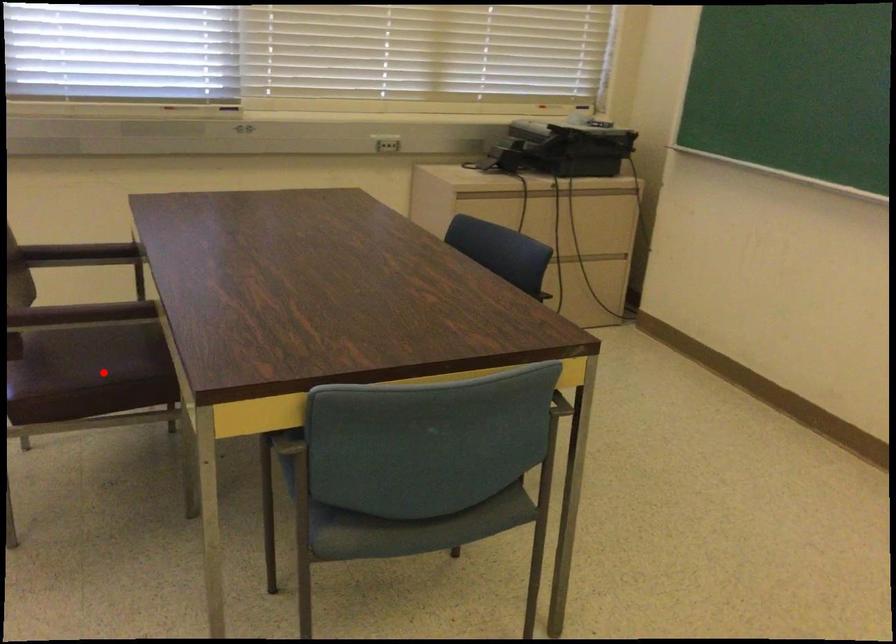
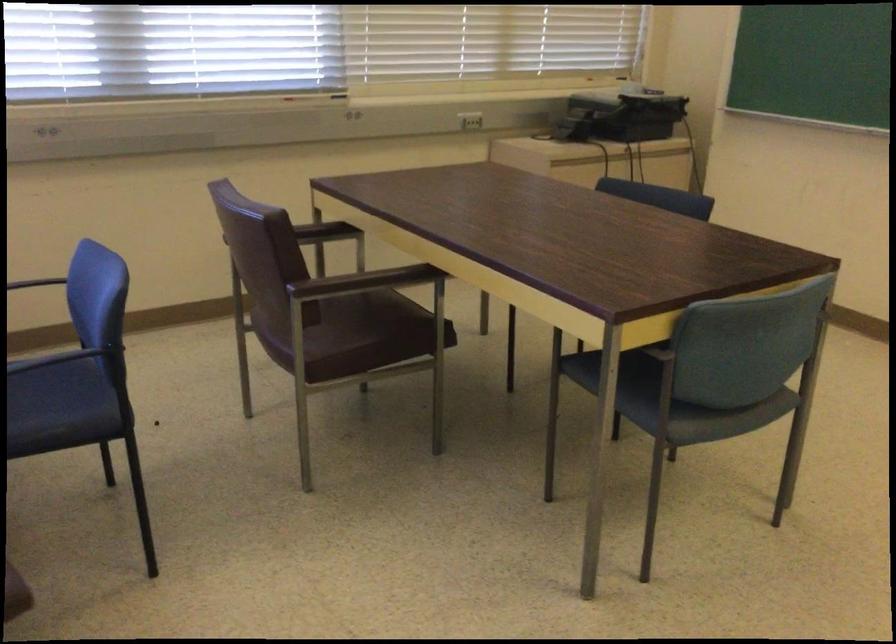
Question: I am providing you with two images of the same scene from different viewpoints. Given a red point in image1, look at the same physical point in image2. Is it:

Choices:
 (A) Closer to the viewpoint
 (B) Farther from the viewpoint

Answer: (B)